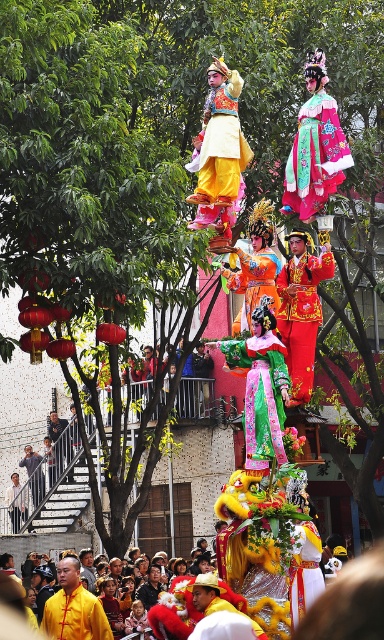
Question: Can you confirm if matte yellow costume at center is bigger than green satin dress at center?

Choices:
 (A) yes
 (B) no

Answer: (A)

Question: Among these points, which one is nearest to the camera?

Choices:
 (A) (228, 236)
 (B) (21, 42)
 (C) (49, 616)

Answer: (A)

Question: Is silky pink fabric at upper center to the left of gold brocade robe at center from the viewer's perspective?

Choices:
 (A) yes
 (B) no

Answer: (B)

Question: Which object appears closest to the camera in this image?

Choices:
 (A) gold brocade robe at center
 (B) matte yellow costume at center

Answer: (A)

Question: Does green leafy tree at upper center have a greater width compared to silky pink fabric at upper center?

Choices:
 (A) yes
 (B) no

Answer: (A)

Question: Which point is farther to the camera?

Choices:
 (A) (182, 173)
 (B) (238, 170)
 (C) (246, 296)

Answer: (A)